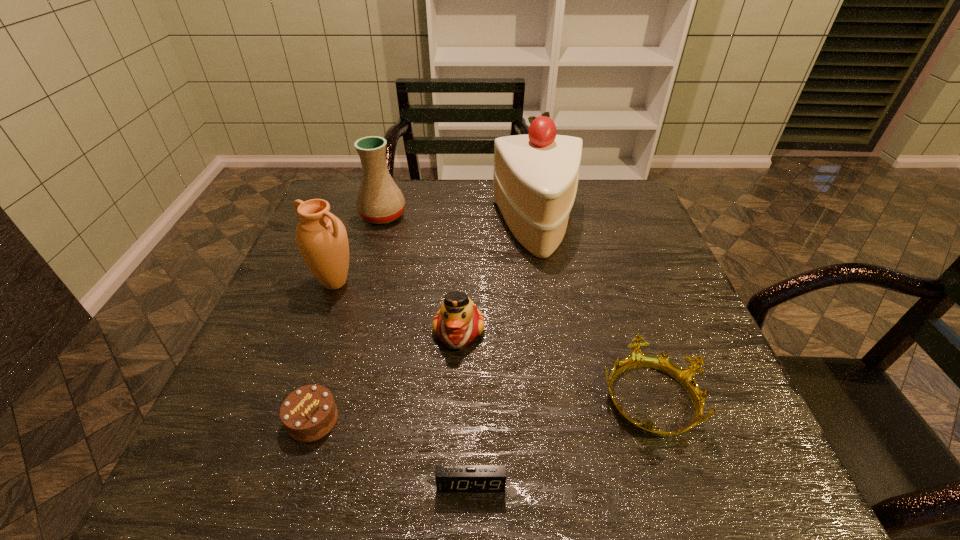
Identify the location of cake. (536, 175).

In order to click on pottery in this screenshot , I will do `click(379, 200)`.

Where is `urn`? urn is located at coordinates (321, 237).

This screenshot has height=540, width=960. Identify the location of the fourth farthest object. [458, 322].

Identify the location of the fourth tallest object. The width and height of the screenshot is (960, 540). pos(458,322).

This screenshot has height=540, width=960. Find the location of `crown`. crown is located at coordinates (685, 376).

The height and width of the screenshot is (540, 960). Identify the location of chocolate cake. pos(309,413).

Find the location of a particular element. This screenshot has height=540, width=960. the nearest object is located at coordinates (449, 478).

Find the location of a particular element. the shortest object is located at coordinates point(449,478).

Find the location of `vacant space positioned 0.140m on the front of the cake`. vacant space positioned 0.140m on the front of the cake is located at coordinates (549, 300).